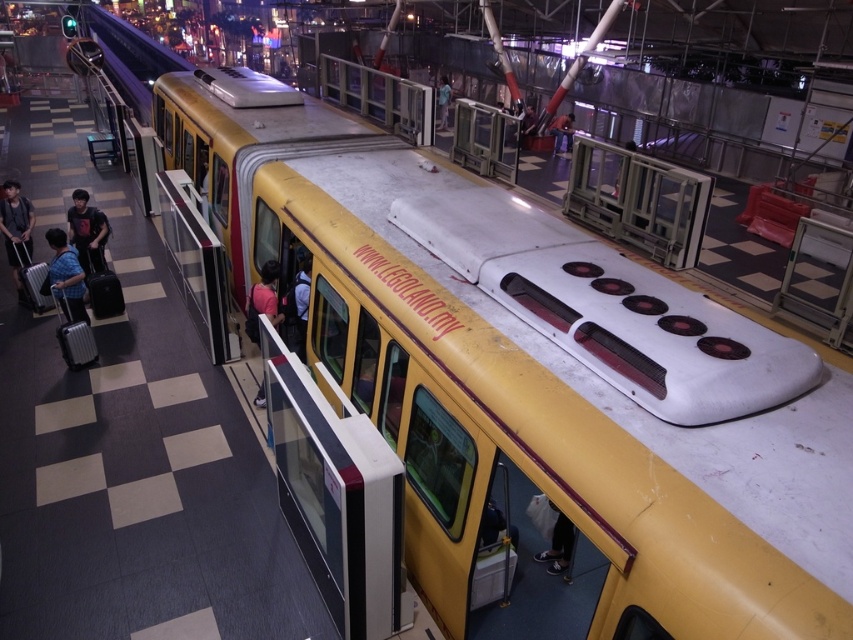
You are standing on the train station platform and see the matte black suitcase at left. Where exactly is it positioned relative to the platform?

The matte black suitcase at left is located at point coordinates of 0.362 on the x axis and 0.020 on the y axis.

You are a photographer on the train platform. You want to take a photo of the matte blue shirt at left and the light blue fabric shirt at center. Which shirt should you zoom in more on to capture both shirts clearly in the frame?

The matte blue shirt at left is smaller than the light blue fabric shirt at center, so you should zoom in more on the light blue fabric shirt at center to ensure both are captured clearly.

You are a passenger at the train station platform. You have a matte black suitcase at left and a dark blue shirt at center. Which item is taller?

The matte black suitcase at left is taller than the dark blue shirt at center.